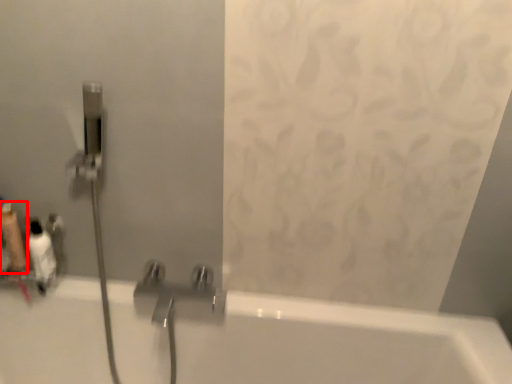
Question: From the image's perspective, where is toiletry (annotated by the red box) located in relation to toiletry in the image?

Choices:
 (A) below
 (B) above

Answer: (B)